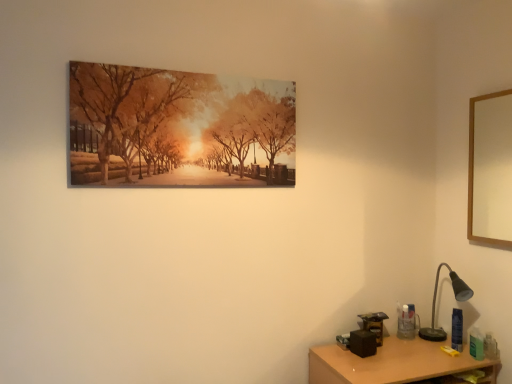
Question: Does matte canvas print at upper center, placed as the first picture frame when sorted from left to right, have a larger size compared to wooden desk at lower right?

Choices:
 (A) no
 (B) yes

Answer: (A)

Question: Is the depth of matte canvas print at upper center, placed as the first picture frame when sorted from left to right, less than that of wooden desk at lower right?

Choices:
 (A) yes
 (B) no

Answer: (A)

Question: Does matte canvas print at upper center, placed as the first picture frame when sorted from left to right, have a greater width compared to wooden desk at lower right?

Choices:
 (A) no
 (B) yes

Answer: (A)

Question: Is matte canvas print at upper center, placed as the first picture frame when sorted from left to right, to the right of wooden desk at lower right from the viewer's perspective?

Choices:
 (A) yes
 (B) no

Answer: (B)

Question: Can you confirm if matte canvas print at upper center, placed as the first picture frame when sorted from left to right, is thinner than wooden desk at lower right?

Choices:
 (A) no
 (B) yes

Answer: (B)

Question: Can you confirm if matte canvas print at upper center, placed as the first picture frame when sorted from left to right, is taller than wooden desk at lower right?

Choices:
 (A) yes
 (B) no

Answer: (A)

Question: Considering the relative sizes of wooden picture frame at upper right, the second picture frame from the left, and matte canvas print at upper center, placed as the first picture frame when sorted from left to right, in the image provided, is wooden picture frame at upper right, the second picture frame from the left, wider than matte canvas print at upper center, placed as the first picture frame when sorted from left to right,?

Choices:
 (A) no
 (B) yes

Answer: (B)

Question: From a real-world perspective, is wooden picture frame at upper right, the second picture frame from the left, positioned under matte canvas print at upper center, placed as the first picture frame when sorted from left to right, based on gravity?

Choices:
 (A) no
 (B) yes

Answer: (B)

Question: From the image's perspective, is wooden picture frame at upper right, the first picture frame viewed from the right, located above matte canvas print at upper center, the second picture frame viewed from the right?

Choices:
 (A) no
 (B) yes

Answer: (A)

Question: Can you confirm if wooden picture frame at upper right, the first picture frame viewed from the right, is bigger than matte canvas print at upper center, the second picture frame viewed from the right?

Choices:
 (A) no
 (B) yes

Answer: (A)

Question: Considering the relative positions of wooden picture frame at upper right, the first picture frame viewed from the right, and matte canvas print at upper center, the second picture frame viewed from the right, in the image provided, is wooden picture frame at upper right, the first picture frame viewed from the right, to the right of matte canvas print at upper center, the second picture frame viewed from the right, from the viewer's perspective?

Choices:
 (A) yes
 (B) no

Answer: (A)

Question: Can you confirm if wooden picture frame at upper right, the second picture frame from the left, is smaller than matte canvas print at upper center, the second picture frame viewed from the right?

Choices:
 (A) no
 (B) yes

Answer: (B)

Question: Does black metal table lamp at lower right appear on the left side of wooden desk at lower right?

Choices:
 (A) no
 (B) yes

Answer: (A)